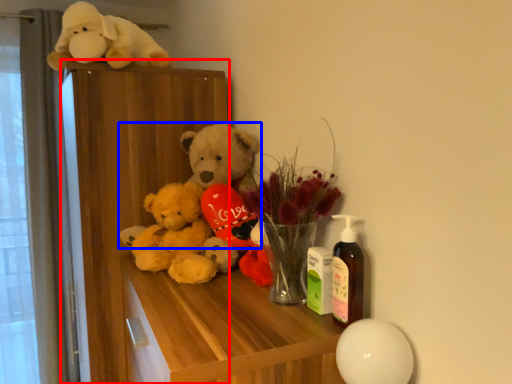
Question: Which point is closer to the camera, dresser (highlighted by a red box) or teddy bear (highlighted by a blue box)?

Choices:
 (A) dresser
 (B) teddy bear

Answer: (B)